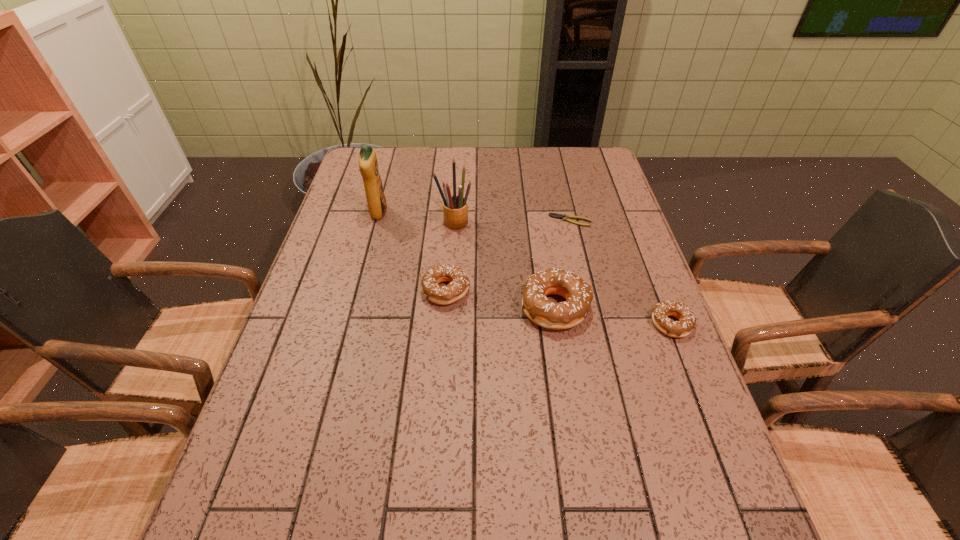
You are a GUI agent. You are given a task and a screenshot of the screen. Output one action in this format:
    pyautogui.click(x=<x>, y=<y>)
    Task: Click on the vacant space that satisfies the following two spatial constraints: 1. on the label of the tallest object; 2. on the right side of the pencil box
    The width and height of the screenshot is (960, 540).
    Given the screenshot: What is the action you would take?
    pyautogui.click(x=376, y=221)

At what (x,y) coordinates should I click in order to perform the action: click on blank space that satisfies the following two spatial constraints: 1. on the back side of the third tallest object; 2. on the label of the leftmost object. Please return your answer as a coordinate pair (x, y). The height and width of the screenshot is (540, 960). Looking at the image, I should click on (540, 213).

You are a GUI agent. You are given a task and a screenshot of the screen. Output one action in this format:
    pyautogui.click(x=<x>, y=<y>)
    Task: Click on the vacant space that satisfies the following two spatial constraints: 1. on the front side of the pencil box; 2. on the left side of the rightmost doughnut
    
    Given the screenshot: What is the action you would take?
    pyautogui.click(x=447, y=324)

Where is `free space that satisfies the following two spatial constraints: 1. on the front side of the third tallest object; 2. on the left side of the leftmost doughnut`? Image resolution: width=960 pixels, height=540 pixels. free space that satisfies the following two spatial constraints: 1. on the front side of the third tallest object; 2. on the left side of the leftmost doughnut is located at coordinates (444, 307).